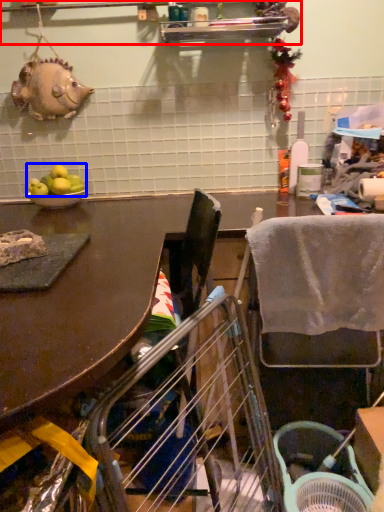
Question: Which of the following is the closest to the observer, shelf (highlighted by a red box) or fruit (highlighted by a blue box)?

Choices:
 (A) shelf
 (B) fruit

Answer: (A)